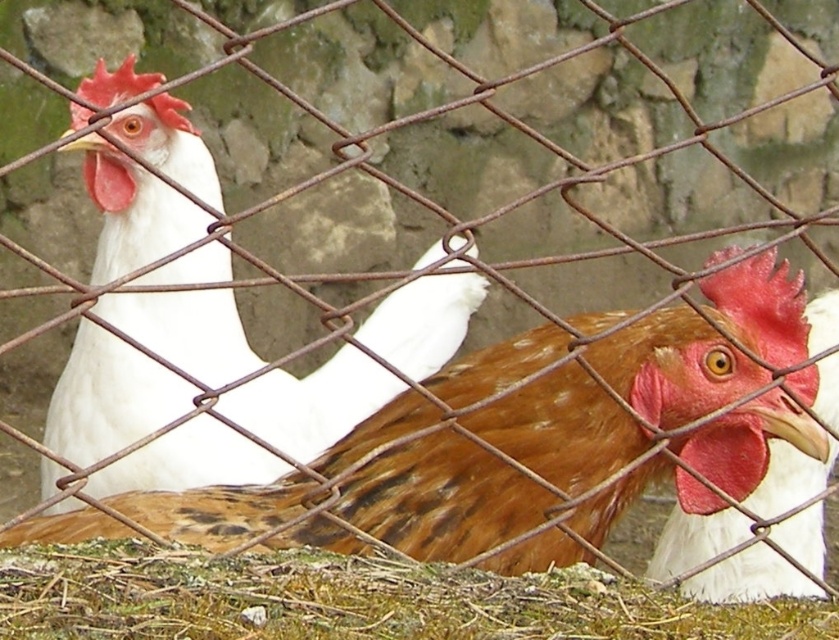
Consider the image. You are standing in the farmyard and want to place a small treat between the two points, point (571, 589) and point (662, 532). Which point should you place the treat closer to so that it is in front of the other point?

You should place the treat closer to point (571, 589) because it is in front of point (662, 532).

You are a farmer standing in the farmyard where the two chickens are. You need to reach the brown textured hay at lower center to feed the chickens. Can you comfortably reach it without moving your position?

The brown textured hay at lower center is 97.44 centimeters away from you, so yes, you can comfortably reach it without moving your position since the distance is within a typical arm length.

You are standing in a farmyard and see a wire mesh fence with two chickens. One is a white matte chicken at left and the other is a brown and white chicken at right. There is a specific point marked at coordinates (108,397). Which chicken is closer to this point?

The point at (108,397) indicates the white matte chicken at left, so it is closer to that point.